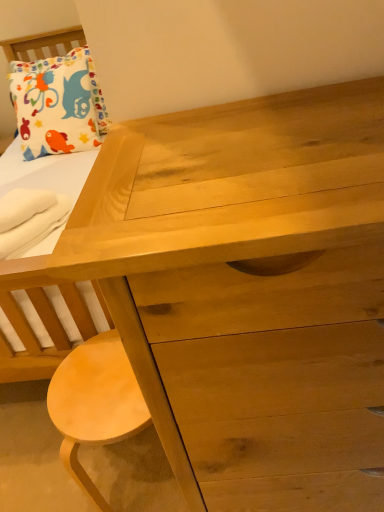
Question: Is white cotton pillow at upper left outside of white soft towel at lower left?

Choices:
 (A) yes
 (B) no

Answer: (A)

Question: Does white cotton pillow at upper left have a larger size compared to white soft towel at lower left?

Choices:
 (A) no
 (B) yes

Answer: (B)

Question: Is there a large distance between white cotton pillow at upper left and white soft towel at lower left?

Choices:
 (A) yes
 (B) no

Answer: (B)

Question: Considering the relative sizes of white cotton pillow at upper left and white soft towel at lower left in the image provided, is white cotton pillow at upper left taller than white soft towel at lower left?

Choices:
 (A) yes
 (B) no

Answer: (A)

Question: From a real-world perspective, is white cotton pillow at upper left positioned under white soft towel at lower left based on gravity?

Choices:
 (A) yes
 (B) no

Answer: (B)

Question: Is white cotton pillow at upper left positioned in front of white soft towel at lower left?

Choices:
 (A) no
 (B) yes

Answer: (A)

Question: Considering the relative sizes of white cotton pillow at upper left and light brown wood stool at lower left in the image provided, is white cotton pillow at upper left smaller than light brown wood stool at lower left?

Choices:
 (A) yes
 (B) no

Answer: (B)

Question: Is white cotton pillow at upper left to the right of light brown wood stool at lower left from the viewer's perspective?

Choices:
 (A) no
 (B) yes

Answer: (A)

Question: Is white cotton pillow at upper left further to the viewer compared to light brown wood stool at lower left?

Choices:
 (A) yes
 (B) no

Answer: (A)

Question: Does white cotton pillow at upper left come in front of light brown wood stool at lower left?

Choices:
 (A) no
 (B) yes

Answer: (A)

Question: Could you tell me if white cotton pillow at upper left is facing light brown wood stool at lower left?

Choices:
 (A) no
 (B) yes

Answer: (B)

Question: From the image's perspective, is white cotton pillow at upper left on light brown wood stool at lower left?

Choices:
 (A) yes
 (B) no

Answer: (A)

Question: From a real-world perspective, is light brown wood stool at lower left on top of white soft towel at lower left?

Choices:
 (A) no
 (B) yes

Answer: (A)